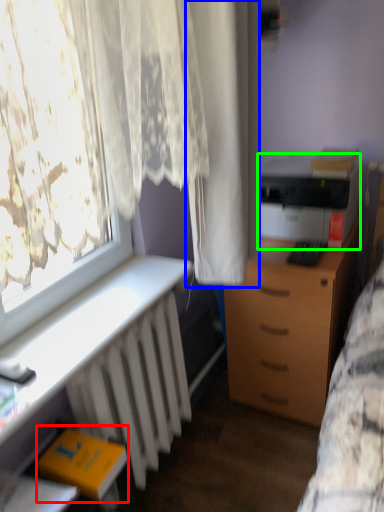
Question: Estimate the real-world distances between objects in this image. Which object is closer to book (highlighted by a red box), curtain (highlighted by a blue box) or printer (highlighted by a green box)?

Choices:
 (A) curtain
 (B) printer

Answer: (A)